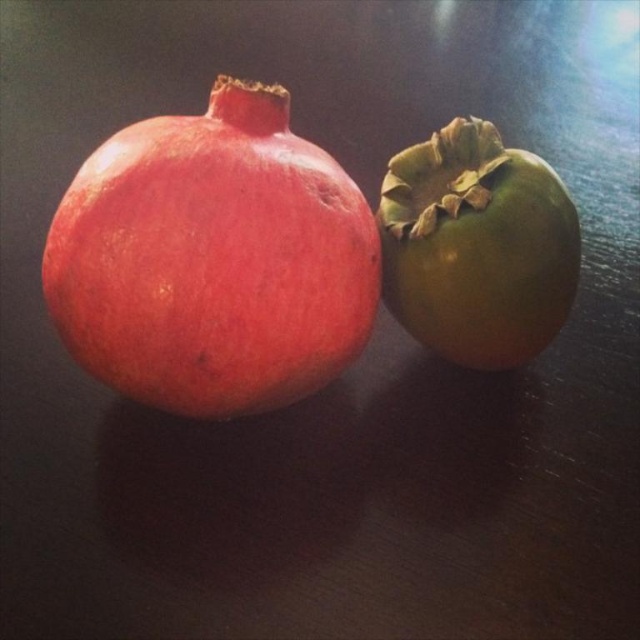
Question: Which point is farther to the camera?

Choices:
 (A) shiny red pomegranate at left
 (B) green matte persimmon at right

Answer: (B)

Question: Which of the following is the closest to the observer?

Choices:
 (A) green matte persimmon at right
 (B) shiny red pomegranate at left

Answer: (B)

Question: Is shiny red pomegranate at left to the left of green matte persimmon at right from the viewer's perspective?

Choices:
 (A) no
 (B) yes

Answer: (B)

Question: Can you confirm if shiny red pomegranate at left is thinner than green matte persimmon at right?

Choices:
 (A) yes
 (B) no

Answer: (B)

Question: Does shiny red pomegranate at left appear on the left side of green matte persimmon at right?

Choices:
 (A) yes
 (B) no

Answer: (A)